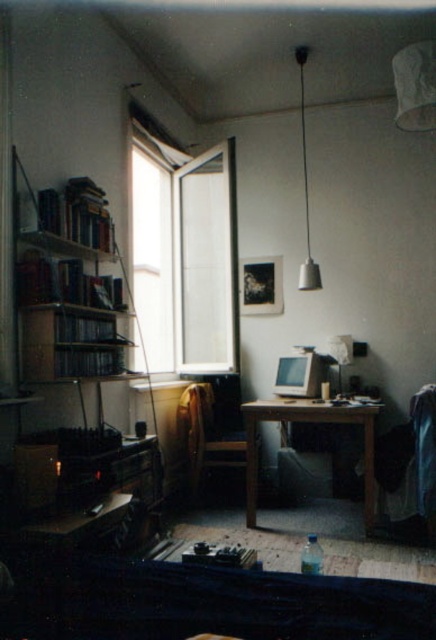
Question: Can you confirm if transparent glass window at upper left is bigger than wooden bookshelf at left?

Choices:
 (A) yes
 (B) no

Answer: (A)

Question: Which of these objects is positioned closest to the wooden table at center?

Choices:
 (A) metallic silver lampshade at upper center
 (B) wooden bookshelf at left
 (C) transparent glass window at upper left

Answer: (C)

Question: Is transparent glass window at upper left positioned at the back of wooden chair at center?

Choices:
 (A) no
 (B) yes

Answer: (A)

Question: Which object appears closest to the camera in this image?

Choices:
 (A) wooden bookshelf at left
 (B) metallic silver lampshade at upper center
 (C) wooden chair at center
 (D) transparent glass window at upper left

Answer: (A)

Question: Observing the image, what is the correct spatial positioning of transparent glass window at upper left in reference to metallic silver lampshade at upper center?

Choices:
 (A) above
 (B) below

Answer: (B)

Question: Which point is farther from the camera taking this photo?

Choices:
 (A) (53, 376)
 (B) (191, 307)
 (C) (205, 400)

Answer: (B)